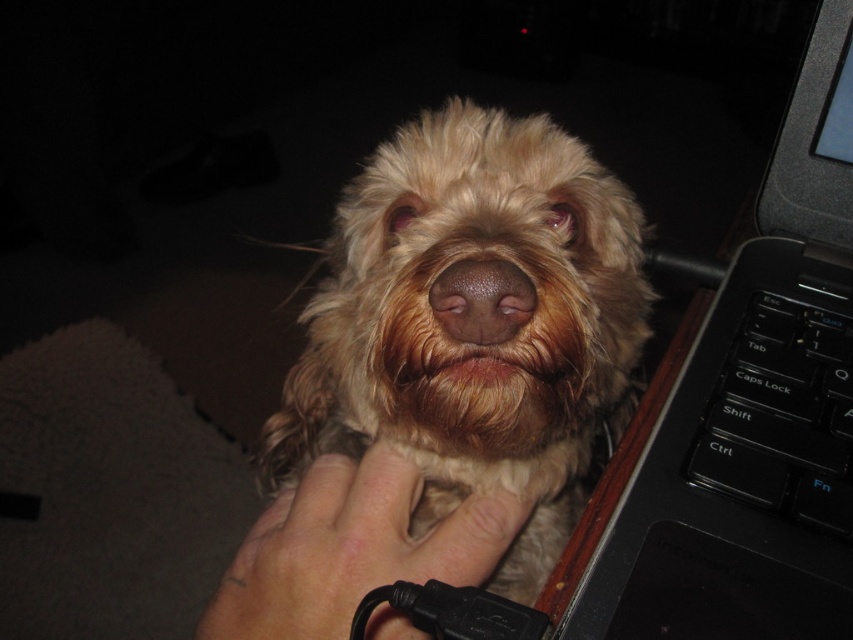
Is black plastic laptop at right wider than black plastic keyboard at right?

Yes.

Who is positioned more to the right, black plastic laptop at right or black plastic keyboard at right?

From the viewer's perspective, black plastic keyboard at right appears more on the right side.

Is point (813, 120) positioned behind point (751, 483)?

Yes, it is.

The width and height of the screenshot is (853, 640). In order to click on black plastic laptop at right in this screenshot , I will do [x=753, y=416].

Does light skin hand at center have a lesser width compared to black plastic keyboard at right?

In fact, light skin hand at center might be wider than black plastic keyboard at right.

The width and height of the screenshot is (853, 640). Identify the location of light skin hand at center. [350, 548].

You are a GUI agent. You are given a task and a screenshot of the screen. Output one action in this format:
    pyautogui.click(x=<x>, y=<y>)
    Task: Click on the light skin hand at center
    
    Given the screenshot: What is the action you would take?
    [x=350, y=548]

Is point (643, 595) positioned behind point (283, 621)?

No, (643, 595) is in front of (283, 621).

Can you confirm if black plastic laptop at right is positioned to the right of light skin hand at center?

Indeed, black plastic laptop at right is positioned on the right side of light skin hand at center.

Is point (592, 579) closer to viewer compared to point (265, 608)?

Yes, point (592, 579) is in front of point (265, 608).

In order to click on black plastic laptop at right in this screenshot , I will do `click(753, 416)`.